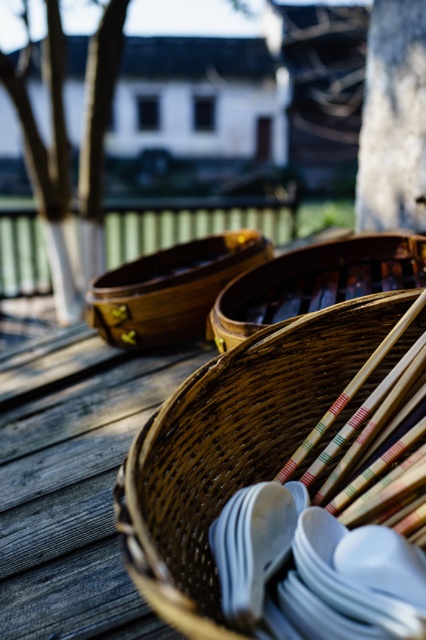
Question: Observing the image, what is the correct spatial positioning of woven bamboo basket at center in reference to wooden canoe at center?

Choices:
 (A) left
 (B) right

Answer: (B)

Question: Estimate the real-world distances between objects in this image. Which object is closer to the woven bamboo basket at center?

Choices:
 (A) brown woven basket at center
 (B) wooden canoe at center
 (C) green leafy tree at left

Answer: (A)

Question: Which object is closer to the camera taking this photo?

Choices:
 (A) wooden chopsticks at center
 (B) green leafy tree at left

Answer: (A)

Question: Is green leafy tree at left further to the viewer compared to gray rough bark at upper right?

Choices:
 (A) no
 (B) yes

Answer: (B)

Question: Which point is closer to the camera?

Choices:
 (A) gray rough bark at upper right
 (B) brown woven basket at center
 (C) wooden chopsticks at center

Answer: (C)

Question: Observing the image, what is the correct spatial positioning of gray rough bark at upper right in reference to wooden canoe at center?

Choices:
 (A) right
 (B) left

Answer: (A)